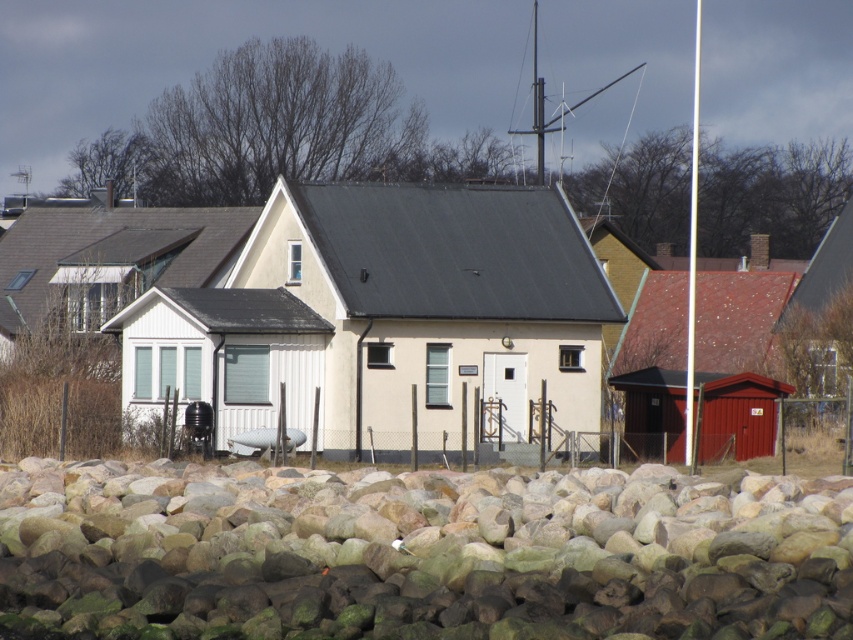
Is smooth gray rock at lower center closer to camera compared to white wood cabin at left?

Yes.

How distant is smooth gray rock at lower center from white wood cabin at left?

A distance of 31.48 meters exists between smooth gray rock at lower center and white wood cabin at left.

You are a GUI agent. You are given a task and a screenshot of the screen. Output one action in this format:
    pyautogui.click(x=<x>, y=<y>)
    Task: Click on the smooth gray rock at lower center
    
    Given the screenshot: What is the action you would take?
    pyautogui.click(x=431, y=557)

Which is more to the right, beige wood house at center or white wood cabin at left?

beige wood house at center

Can you confirm if beige wood house at center is shorter than white wood cabin at left?

Yes.

Does point (596, 401) come behind point (48, 225)?

No, it is not.

Identify the location of beige wood house at center. (x=438, y=300).

Describe the element at coordinates (431, 557) in the screenshot. I see `smooth gray rock at lower center` at that location.

Is point (585, 627) more distant than point (572, 232)?

No, it is not.

Locate an element on the screen. This screenshot has height=640, width=853. smooth gray rock at lower center is located at coordinates (431, 557).